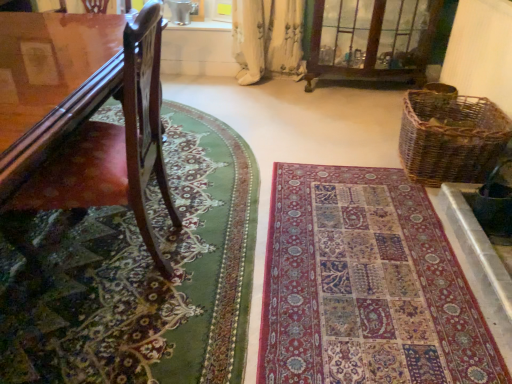
Question: Is clear glass cabinet at upper center taller or shorter than shiny brown wood chair at left?

Choices:
 (A) short
 (B) tall

Answer: (A)

Question: Is clear glass cabinet at upper center inside the boundaries of shiny brown wood chair at left, or outside?

Choices:
 (A) inside
 (B) outside

Answer: (B)

Question: Estimate the real-world distances between objects in this image. Which object is farther from the woven brown picnic basket at right?

Choices:
 (A) clear glass cabinet at upper center
 (B) shiny brown wood chair at left
 (C) green woolen rug at lower left, marked as the 1th mat in a left-to-right arrangement
 (D) multicolored woven rug at center, the 2th mat when ordered from left to right

Answer: (B)

Question: Which of these objects is positioned closest to the green woolen rug at lower left, marked as the 1th mat in a left-to-right arrangement?

Choices:
 (A) clear glass cabinet at upper center
 (B) shiny brown wood chair at left
 (C) multicolored woven rug at center, marked as the 1th mat in a right-to-left arrangement
 (D) woven brown picnic basket at right

Answer: (B)